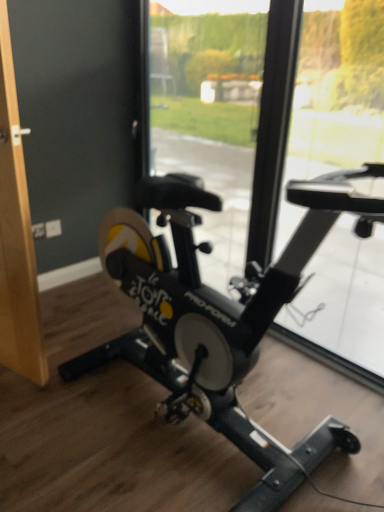
Question: Which direction should I rotate to look at transparent glass window at center, which appears as the second window screen when viewed from the right, — up or down?

Choices:
 (A) down
 (B) up

Answer: (B)

Question: Is black matte stationary bicycle at center taller than wooden door handle at left?

Choices:
 (A) yes
 (B) no

Answer: (B)

Question: Does black matte stationary bicycle at center appear on the right side of wooden door handle at left?

Choices:
 (A) yes
 (B) no

Answer: (A)

Question: Considering the relative sizes of black matte stationary bicycle at center and wooden door handle at left in the image provided, is black matte stationary bicycle at center bigger than wooden door handle at left?

Choices:
 (A) yes
 (B) no

Answer: (A)

Question: From a real-world perspective, is black matte stationary bicycle at center over wooden door handle at left?

Choices:
 (A) yes
 (B) no

Answer: (B)

Question: Is black matte stationary bicycle at center not within wooden door handle at left?

Choices:
 (A) no
 (B) yes

Answer: (B)

Question: Is black matte stationary bicycle at center oriented away from wooden door handle at left?

Choices:
 (A) no
 (B) yes

Answer: (A)

Question: Is transparent glass window at center, the 1th window screen positioned from the left, taller than wooden door handle at left?

Choices:
 (A) yes
 (B) no

Answer: (A)

Question: From the image's perspective, is transparent glass window at center, the 1th window screen positioned from the left, above wooden door handle at left?

Choices:
 (A) no
 (B) yes

Answer: (B)

Question: From the image's perspective, is transparent glass window at center, the 1th window screen positioned from the left, below wooden door handle at left?

Choices:
 (A) no
 (B) yes

Answer: (A)

Question: From a real-world perspective, is transparent glass window at center, the 1th window screen positioned from the left, located higher than wooden door handle at left?

Choices:
 (A) yes
 (B) no

Answer: (A)

Question: Is transparent glass window at center, the 1th window screen positioned from the left, wider than wooden door handle at left?

Choices:
 (A) no
 (B) yes

Answer: (B)

Question: Is transparent glass window at center, which appears as the second window screen when viewed from the right, bigger than wooden door handle at left?

Choices:
 (A) no
 (B) yes

Answer: (B)

Question: Is black matte stationary bicycle at center to the right of transparent glass window at center, which appears as the second window screen when viewed from the right, from the viewer's perspective?

Choices:
 (A) no
 (B) yes

Answer: (B)